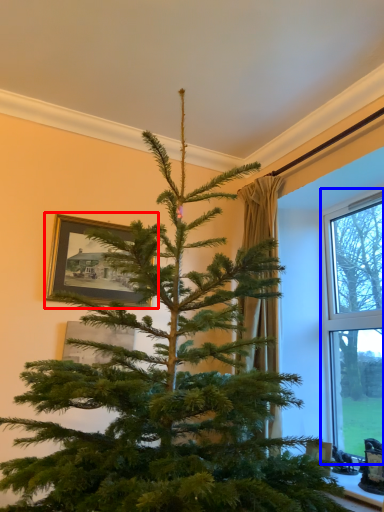
Question: Among these objects, which one is farthest to the camera, picture frame (highlighted by a red box) or window (highlighted by a blue box)?

Choices:
 (A) picture frame
 (B) window

Answer: (A)